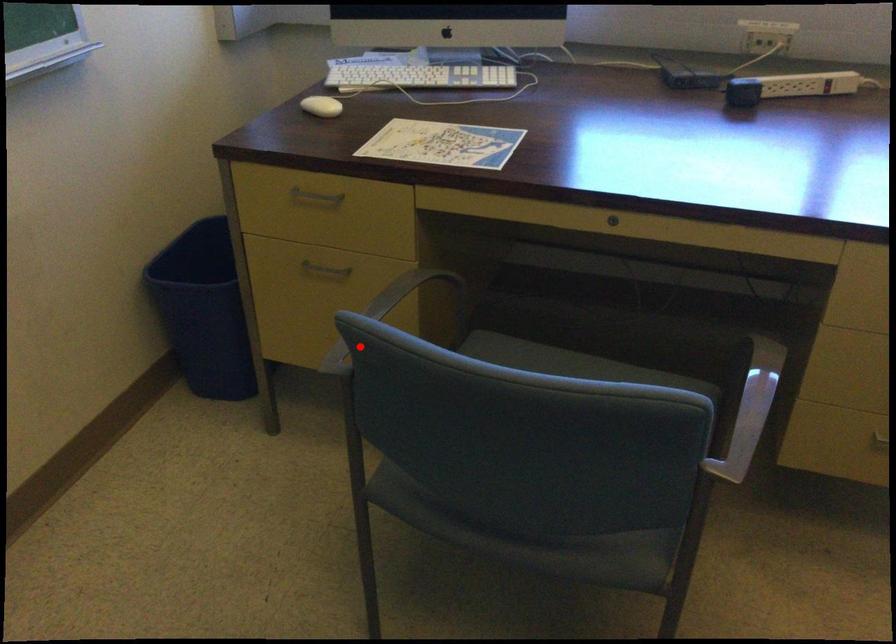
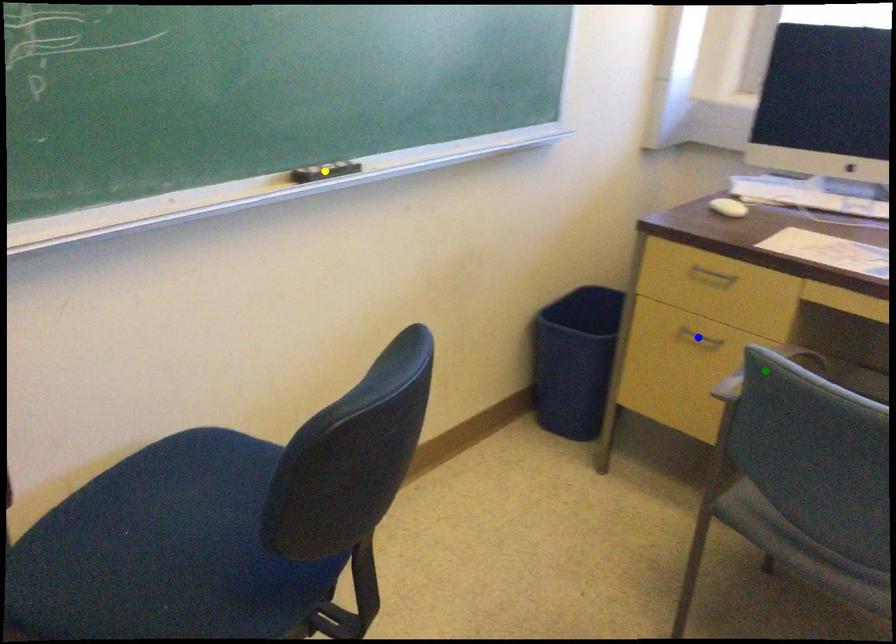
Question: I am providing you with two images of the same scene from different viewpoints. A red point is marked on the first image. You are given multiple points on the second image. Which mark in image 2 goes with the point in image 1?

Choices:
 (A) green point
 (B) yellow point
 (C) blue point

Answer: (A)